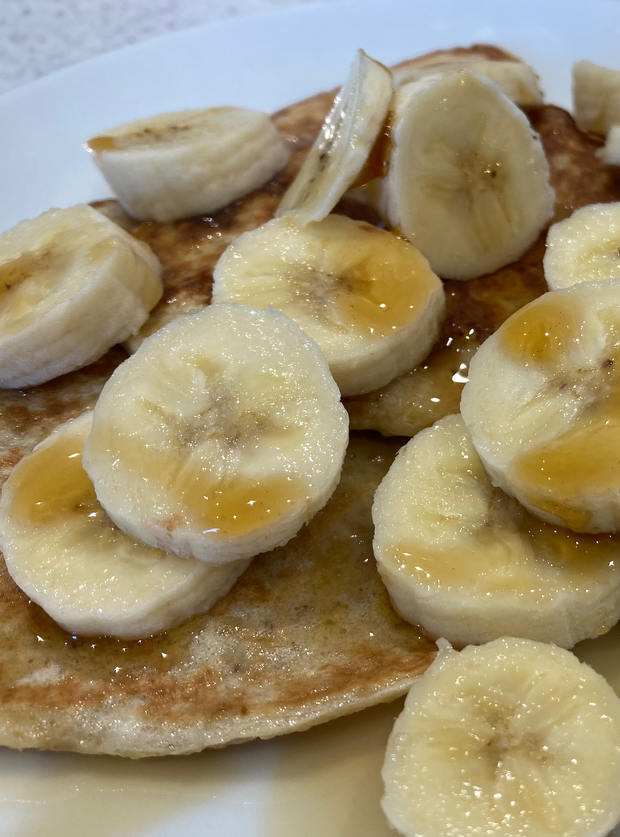
Find the location of a particular element. plate showing under food is located at coordinates (214, 793).